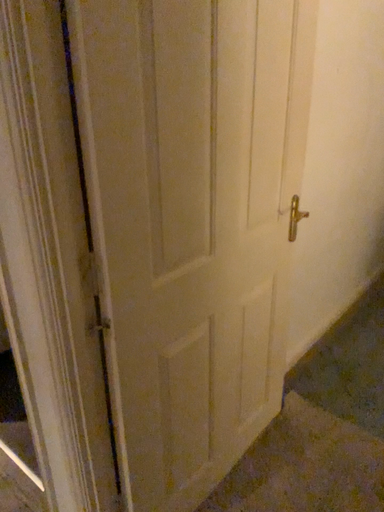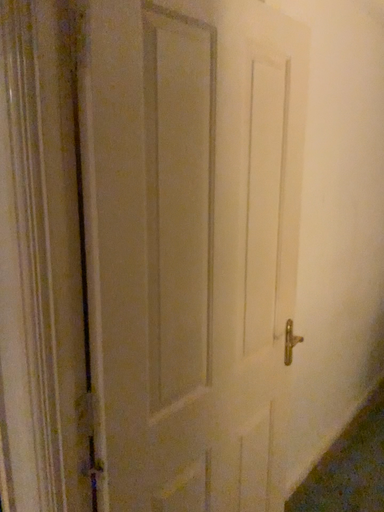
Question: How did the camera likely rotate when shooting the video?

Choices:
 (A) rotated downward
 (B) rotated upward

Answer: (B)